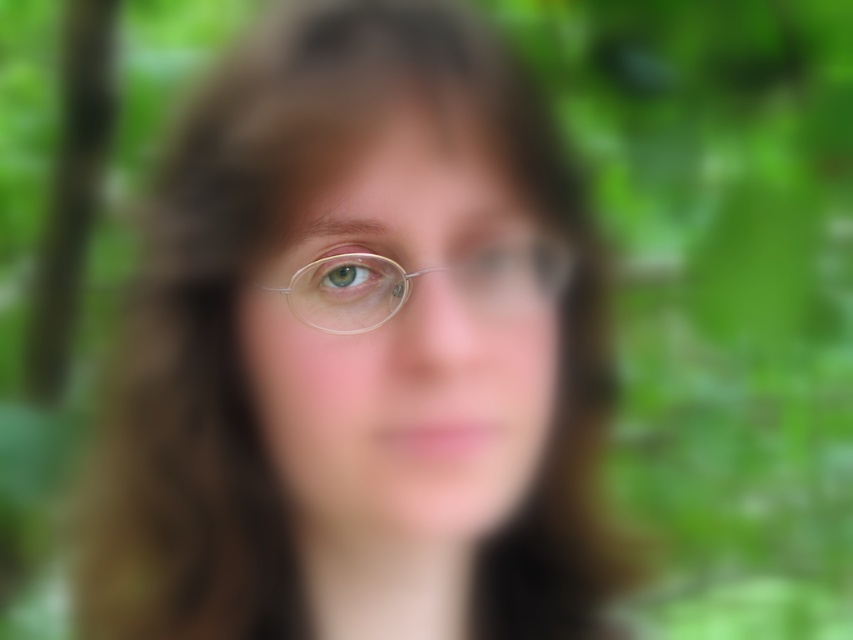
Question: Which point is farther to the camera?

Choices:
 (A) (257, 397)
 (B) (256, 376)
 (C) (473, 300)
 (D) (372, 280)

Answer: (A)

Question: Can you confirm if matte silver glasses at center is wider than clear plastic glasses at center?

Choices:
 (A) no
 (B) yes

Answer: (B)

Question: Which object appears farthest from the camera in this image?

Choices:
 (A) green matte eye at center
 (B) clear plastic glasses at center
 (C) matte silver glasses at center

Answer: (A)

Question: Is matte gold glasses at center to the left of clear plastic glasses at center from the viewer's perspective?

Choices:
 (A) yes
 (B) no

Answer: (A)

Question: Does clear plastic glasses at center have a lesser width compared to green matte eye at center?

Choices:
 (A) no
 (B) yes

Answer: (A)

Question: Estimate the real-world distances between objects in this image. Which object is closer to the green matte eye at center?

Choices:
 (A) matte gold glasses at center
 (B) clear plastic glasses at center
 (C) matte silver glasses at center

Answer: (B)